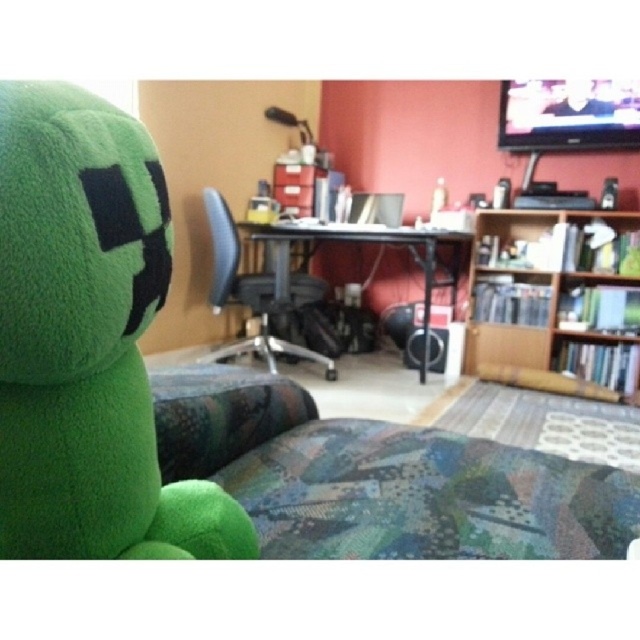
Question: Which point is farther to the camera?

Choices:
 (A) black mesh office chair at center
 (B) black plastic computer desk at center
 (C) wooden bookshelf at right

Answer: (B)

Question: Is wooden bookshelf at right above black mesh office chair at center?

Choices:
 (A) no
 (B) yes

Answer: (B)

Question: Which point appears closest to the camera in this image?

Choices:
 (A) (317, 237)
 (B) (164, 284)
 (C) (236, 276)

Answer: (B)

Question: Based on their relative distances, which object is farther from the wooden bookshelf at right?

Choices:
 (A) green plush toy at left
 (B) black plastic computer desk at center

Answer: (A)

Question: Is green plush toy at left further to the viewer compared to wooden bookshelf at right?

Choices:
 (A) yes
 (B) no

Answer: (B)

Question: Can you confirm if black mesh office chair at center is smaller than black plastic computer desk at center?

Choices:
 (A) no
 (B) yes

Answer: (B)